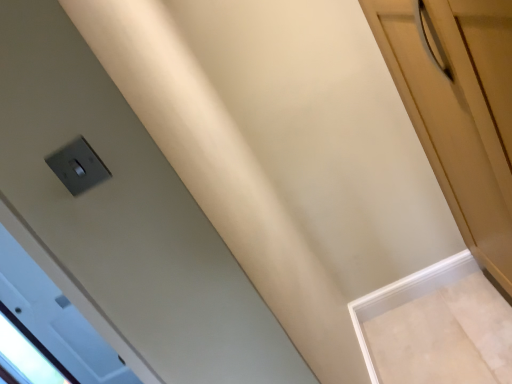
Where is `satin silver switch at upper left`? The image size is (512, 384). satin silver switch at upper left is located at coordinates (78, 166).

The image size is (512, 384). What do you see at coordinates (78, 166) in the screenshot?
I see `satin silver switch at upper left` at bounding box center [78, 166].

Find the location of a particular element. The image size is (512, 384). satin silver switch at upper left is located at coordinates (78, 166).